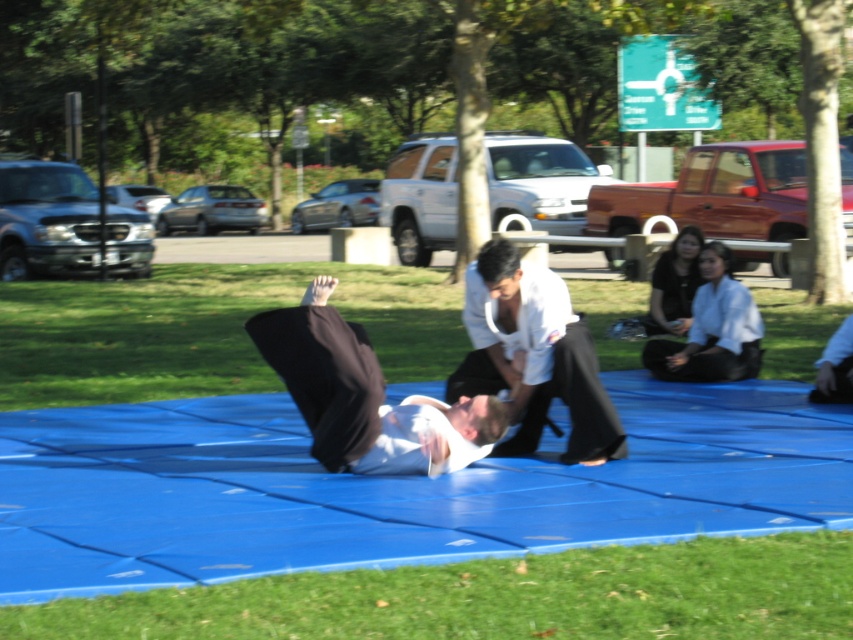
Is green grass at lower center bigger than white fabric kimono at center?

Yes.

Which of these two, green grass at lower center or white fabric kimono at center, stands shorter?

green grass at lower center is shorter.

Which is in front, point (833, 561) or point (471, 442)?

Point (833, 561) is more forward.

Where is `green grass at lower center`? The width and height of the screenshot is (853, 640). green grass at lower center is located at coordinates (502, 596).

Does green grass at lower center have a lesser height compared to white matte kimono at center?

Yes.

Is point (440, 573) farther from camera compared to point (524, 344)?

No.

Where is `green grass at lower center`? Image resolution: width=853 pixels, height=640 pixels. green grass at lower center is located at coordinates (502, 596).

Does white matte kimono at center have a greater width compared to white fabric kimono at center?

No, white matte kimono at center is not wider than white fabric kimono at center.

Locate an element on the screen. white matte kimono at center is located at coordinates (532, 355).